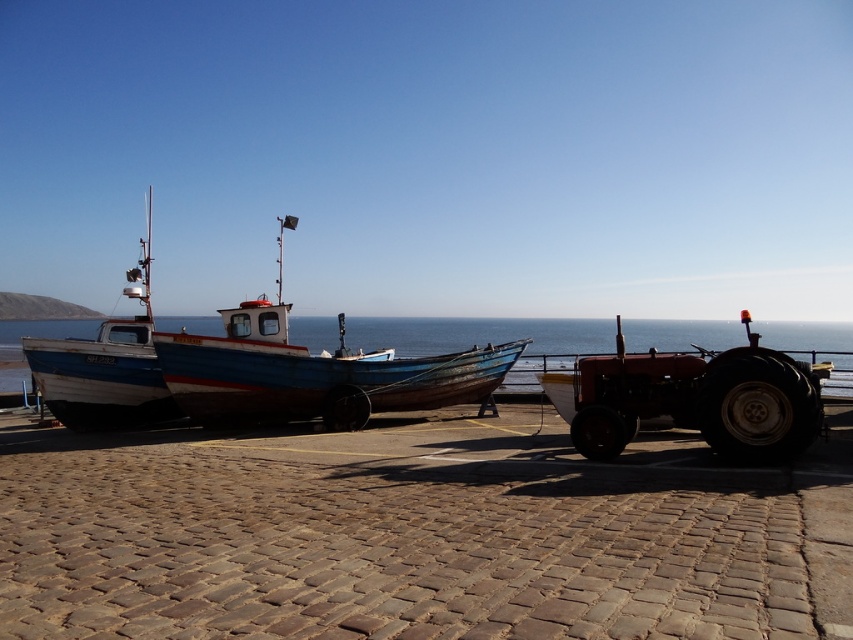
Question: Which is farther from the blue wooden boat at left?

Choices:
 (A) wooden blue boat at center
 (B) white wooden boat at left
 (C) matte red tractor at right

Answer: (C)

Question: Does wooden blue boat at center come in front of blue wooden boat at left?

Choices:
 (A) yes
 (B) no

Answer: (B)

Question: Is wooden blue boat at center to the right of matte red tractor at right from the viewer's perspective?

Choices:
 (A) yes
 (B) no

Answer: (B)

Question: Among these points, which one is nearest to the camera?

Choices:
 (A) coord(132,324)
 (B) coord(341,365)
 (C) coord(723,385)

Answer: (C)

Question: Where is matte red tractor at right located in relation to blue wooden boat at left in the image?

Choices:
 (A) right
 (B) left

Answer: (B)

Question: Estimate the real-world distances between objects in this image. Which object is closer to the matte red tractor at right?

Choices:
 (A) white wooden boat at left
 (B) wooden blue boat at center

Answer: (B)